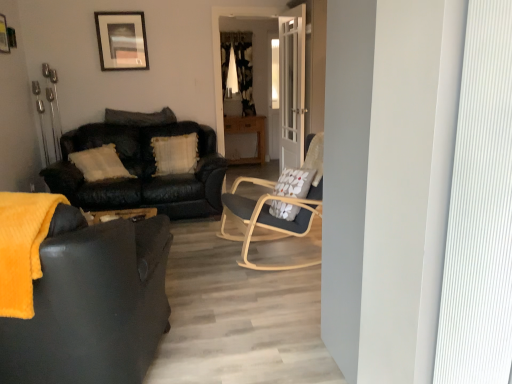
Question: Does light wood/woodenchair at center have a greater height compared to leather couch at center, placed as the 2th studio couch when sorted from front to back?

Choices:
 (A) no
 (B) yes

Answer: (A)

Question: Is light wood/woodenchair at center turned away from leather couch at center, placed as the 2th studio couch when sorted from front to back?

Choices:
 (A) no
 (B) yes

Answer: (A)

Question: Is light wood/woodenchair at center positioned beyond the bounds of leather couch at center, which appears as the 1th studio couch when viewed from the back?

Choices:
 (A) no
 (B) yes

Answer: (B)

Question: Does light wood/woodenchair at center touch leather couch at center, which appears as the 1th studio couch when viewed from the back?

Choices:
 (A) yes
 (B) no

Answer: (B)

Question: Does light wood/woodenchair at center have a smaller size compared to leather couch at center, placed as the 2th studio couch when sorted from front to back?

Choices:
 (A) no
 (B) yes

Answer: (B)

Question: From the image's perspective, is white glass door at center located above or below light wood/woodenchair at center?

Choices:
 (A) below
 (B) above

Answer: (B)

Question: Is white glass door at center bigger or smaller than light wood/woodenchair at center?

Choices:
 (A) small
 (B) big

Answer: (A)

Question: In terms of width, does white glass door at center look wider or thinner when compared to light wood/woodenchair at center?

Choices:
 (A) wide
 (B) thin

Answer: (B)

Question: Visually, is white glass door at center positioned to the left or to the right of light wood/woodenchair at center?

Choices:
 (A) right
 (B) left

Answer: (A)

Question: Is leather couch at center, placed as the 2th studio couch when sorted from front to back, in front of or behind matte black couch at left, which appears as the first studio couch when viewed from the front, in the image?

Choices:
 (A) front
 (B) behind

Answer: (B)

Question: From the image's perspective, relative to matte black couch at left, acting as the second studio couch starting from the back, is leather couch at center, placed as the 2th studio couch when sorted from front to back, above or below?

Choices:
 (A) below
 (B) above

Answer: (B)

Question: Would you say leather couch at center, placed as the 2th studio couch when sorted from front to back, is to the left or to the right of matte black couch at left, acting as the second studio couch starting from the back, in the picture?

Choices:
 (A) right
 (B) left

Answer: (B)

Question: From a real-world perspective, is leather couch at center, placed as the 2th studio couch when sorted from front to back, physically located above or below matte black couch at left, which appears as the first studio couch when viewed from the front?

Choices:
 (A) above
 (B) below

Answer: (B)

Question: Is point (123, 13) closer or farther from the camera than point (4, 23)?

Choices:
 (A) farther
 (B) closer

Answer: (A)

Question: From the image's perspective, is matte black picture frame at upper center, which is the 1th picture frame in back-to-front order, above or below brushed metal picture frame at upper left, placed as the first picture frame when sorted from front to back?

Choices:
 (A) above
 (B) below

Answer: (A)